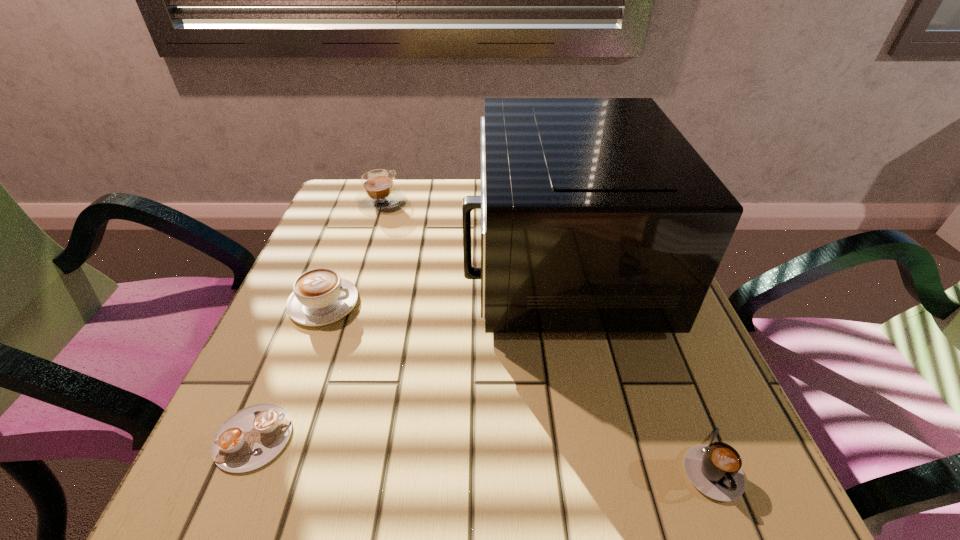
The height and width of the screenshot is (540, 960). Find the location of `free space located 0.340m on the front-facing side of the microwave_oven`. free space located 0.340m on the front-facing side of the microwave_oven is located at coordinates (306, 262).

I want to click on vacant space located 0.300m on the right of the tallest cappuccino, so click(x=523, y=201).

At what (x,y) coordinates should I click in order to perform the action: click on blank space located 0.380m with the handle on the right side of the third nearest cappuccino. Please return your answer as a coordinate pair (x, y). Looking at the image, I should click on (557, 303).

The width and height of the screenshot is (960, 540). Identify the location of blank area located on the right of the shortest object. (457, 437).

Locate an element on the screen. microwave_oven at the far edge is located at coordinates tap(597, 215).

The height and width of the screenshot is (540, 960). I want to click on cappuccino present at the far edge, so click(379, 193).

Where is `microwave_oven at the right edge`? This screenshot has height=540, width=960. microwave_oven at the right edge is located at coordinates (597, 215).

The image size is (960, 540). In order to click on cappuccino situated at the right edge in this screenshot , I will do point(715,470).

Find the location of a particular element. object that is at the far left corner is located at coordinates (379, 193).

Find the location of a particular element. Image resolution: width=960 pixels, height=540 pixels. object that is positioned at the near left corner is located at coordinates (252, 437).